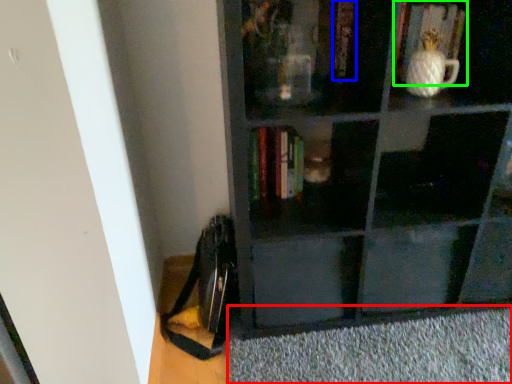
Question: Estimate the real-world distances between objects in this image. Which object is farther from doormat (highlighted by a red box), book (highlighted by a blue box) or book (highlighted by a green box)?

Choices:
 (A) book
 (B) book

Answer: (A)